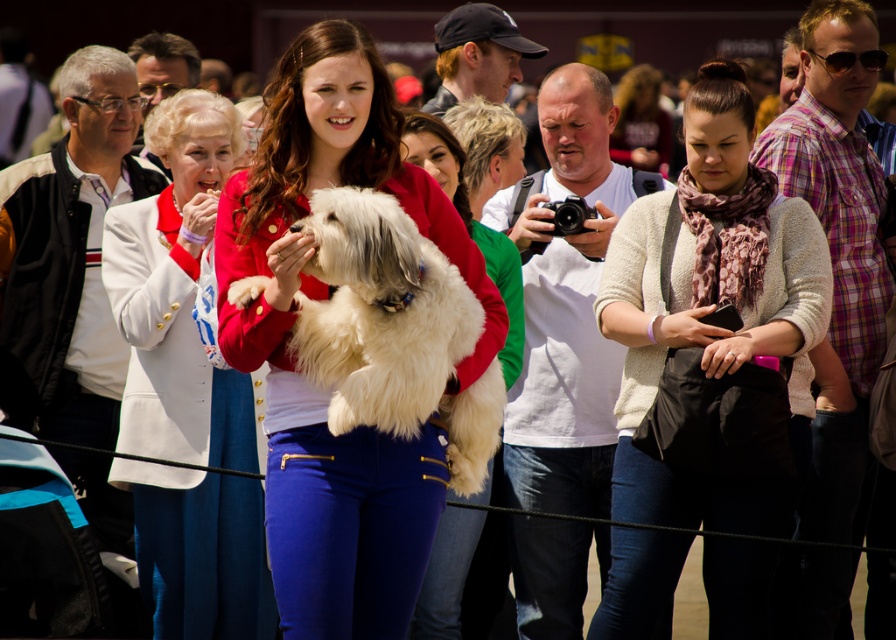
Question: Observing the image, what is the correct spatial positioning of matte red jacket at center in reference to white fluffy dog at center?

Choices:
 (A) below
 (B) above

Answer: (B)

Question: Does matte red jacket at center lie in front of white satin jacket at upper left?

Choices:
 (A) no
 (B) yes

Answer: (B)

Question: Among these points, which one is nearest to the camera?

Choices:
 (A) (329, 497)
 (B) (424, 378)
 (C) (436, 154)

Answer: (B)

Question: Is beige sweater at center bigger than fluffy white dog at center?

Choices:
 (A) yes
 (B) no

Answer: (A)

Question: Estimate the real-world distances between objects in this image. Which object is closer to the white satin jacket at upper left?

Choices:
 (A) beige sweater at center
 (B) white fluffy dog at center
 (C) fluffy white dog at center
 (D) matte red jacket at center

Answer: (C)

Question: Based on their relative distances, which object is nearer to the beige sweater at center?

Choices:
 (A) matte red jacket at center
 (B) white satin jacket at upper left
 (C) white fluffy dog at center
 (D) fluffy white dog at center

Answer: (D)